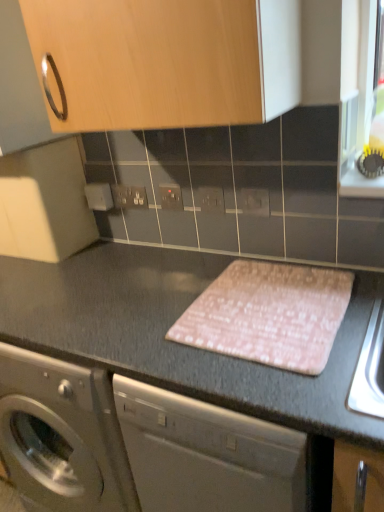
Question: Is matte gray electric outlet at center, marked as the first electric outlet in a front-to-back arrangement, a part of white plastic electric outlet at center, marked as the 2th electric outlet in a right-to-left arrangement?

Choices:
 (A) no
 (B) yes

Answer: (A)

Question: Considering the relative sizes of white plastic electric outlet at center, marked as the 2th electric outlet in a right-to-left arrangement, and matte gray electric outlet at center, the 4th electric outlet positioned from the back, in the image provided, is white plastic electric outlet at center, marked as the 2th electric outlet in a right-to-left arrangement, thinner than matte gray electric outlet at center, the 4th electric outlet positioned from the back,?

Choices:
 (A) yes
 (B) no

Answer: (B)

Question: Is white plastic electric outlet at center, the third electric outlet viewed from the back, aimed at matte gray electric outlet at center, marked as the first electric outlet in a front-to-back arrangement?

Choices:
 (A) yes
 (B) no

Answer: (B)

Question: Considering the relative positions of white plastic electric outlet at center, the third electric outlet viewed from the back, and matte gray electric outlet at center, arranged as the fourth electric outlet when viewed from the left, in the image provided, is white plastic electric outlet at center, the third electric outlet viewed from the back, to the left of matte gray electric outlet at center, arranged as the fourth electric outlet when viewed from the left, from the viewer's perspective?

Choices:
 (A) no
 (B) yes

Answer: (B)

Question: Is white plastic electric outlet at center, the third electric outlet viewed from the back, oriented away from matte gray electric outlet at center, the 4th electric outlet positioned from the back?

Choices:
 (A) no
 (B) yes

Answer: (A)

Question: Looking at their shapes, would you say pink fabric placemat at center is wider or thinner than white plastic electric outlet at center, the third electric outlet viewed from the back?

Choices:
 (A) wide
 (B) thin

Answer: (A)

Question: In terms of size, does pink fabric placemat at center appear bigger or smaller than white plastic electric outlet at center, which ranks as the 3th electric outlet in left-to-right order?

Choices:
 (A) small
 (B) big

Answer: (B)

Question: From the image's perspective, relative to white plastic electric outlet at center, which ranks as the 3th electric outlet in left-to-right order, is pink fabric placemat at center above or below?

Choices:
 (A) below
 (B) above

Answer: (A)

Question: Considering the relative positions of pink fabric placemat at center and white plastic electric outlet at center, which ranks as the 3th electric outlet in left-to-right order, in the image provided, is pink fabric placemat at center to the left or to the right of white plastic electric outlet at center, which ranks as the 3th electric outlet in left-to-right order,?

Choices:
 (A) right
 (B) left

Answer: (A)

Question: Considering their positions, is matte plastic electrical outlet at center, the 3th electric outlet in the right-to-left sequence, located in front of or behind pink fabric placemat at center?

Choices:
 (A) behind
 (B) front

Answer: (A)

Question: Is matte plastic electrical outlet at center, the 3th electric outlet in the right-to-left sequence, bigger or smaller than pink fabric placemat at center?

Choices:
 (A) small
 (B) big

Answer: (A)

Question: Visually, is matte plastic electrical outlet at center, acting as the 3th electric outlet starting from the front, positioned to the left or to the right of pink fabric placemat at center?

Choices:
 (A) right
 (B) left

Answer: (B)

Question: Is matte plastic electrical outlet at center, acting as the 2th electric outlet starting from the back, wider or thinner than pink fabric placemat at center?

Choices:
 (A) wide
 (B) thin

Answer: (B)

Question: Is pink fabric at center to the left or to the right of white plastic electric outlet at center, the third electric outlet viewed from the back, in the image?

Choices:
 (A) right
 (B) left

Answer: (A)

Question: From a real-world perspective, relative to white plastic electric outlet at center, which ranks as the 3th electric outlet in left-to-right order, is pink fabric at center vertically above or below?

Choices:
 (A) above
 (B) below

Answer: (B)